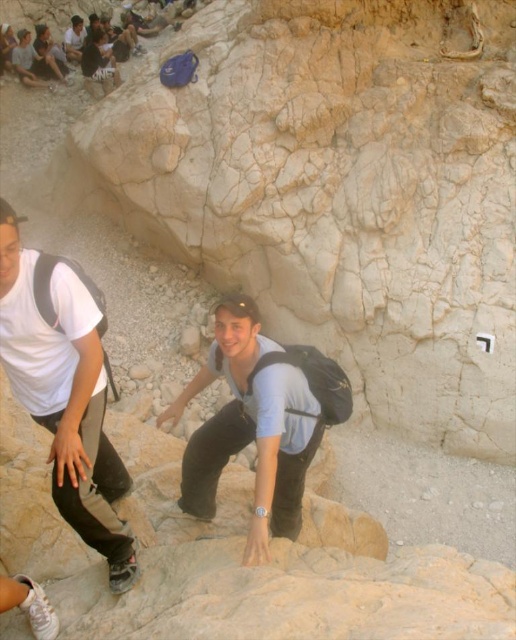
You are a photographer trying to capture the scene of the two climbers. You want to ensure that both the white matte shirt at upper left and the matte black backpack at center are clearly visible in your shot. Considering their sizes, which object might you need to adjust your focus on to ensure it doesn

The white matte shirt at upper left is thinner than the matte black backpack at center, so you may need to focus more on the white matte shirt at upper left to ensure it is clearly visible due to its smaller size.

Based on the scene described, which object, the white matte shirt at upper left or the matte black backpack at center, appears taller when viewed from the observer perspective?

The white matte shirt at upper left appears taller than the matte black backpack at center as stated in the objects description.